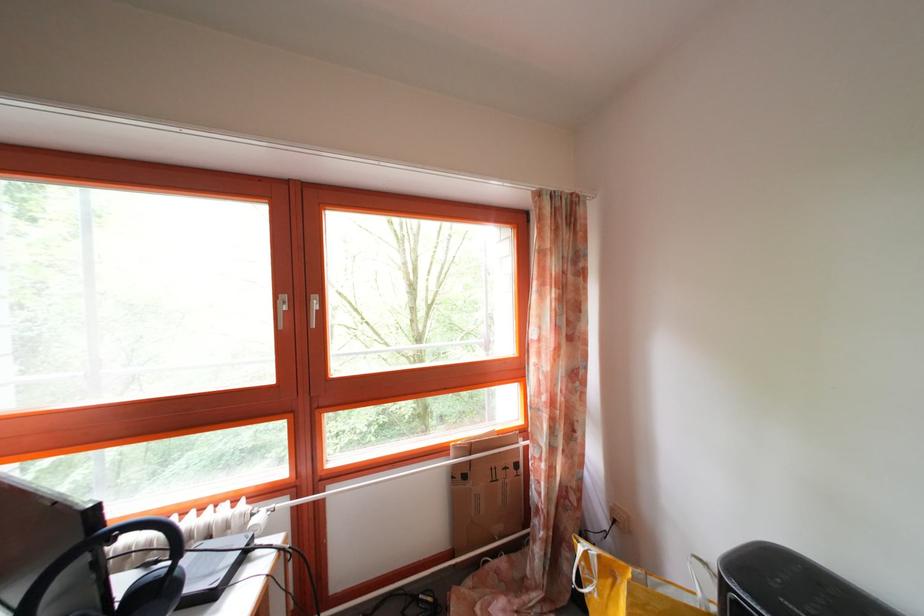
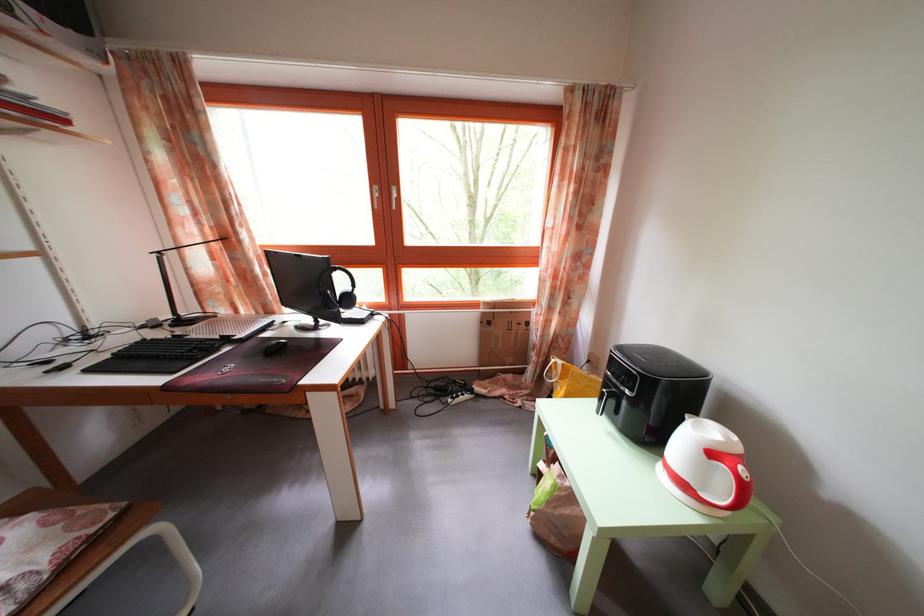
Looking at this image, what movement of the cameraman would produce the second image?

The cameraman walked toward right, backward.